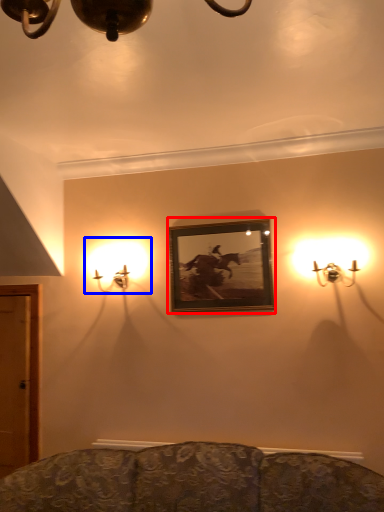
Question: Which object is closer to the camera taking this photo, picture frame (highlighted by a red box) or lamp (highlighted by a blue box)?

Choices:
 (A) picture frame
 (B) lamp

Answer: (A)